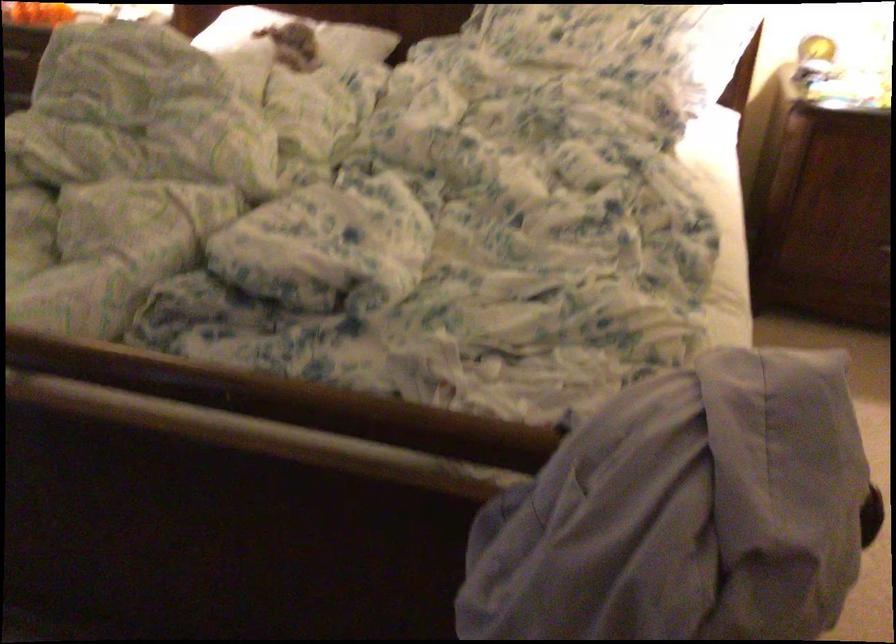
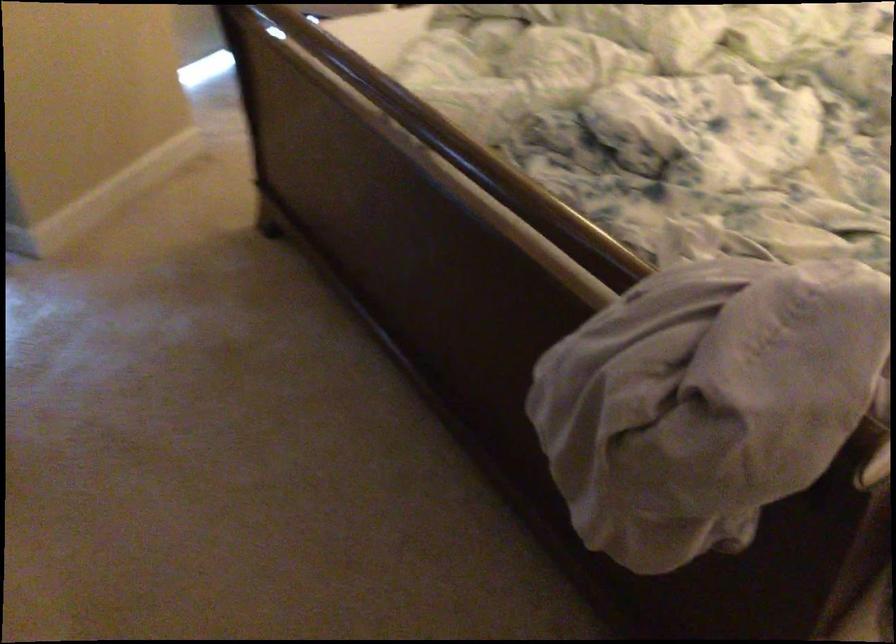
Question: How did the camera likely rotate?

Choices:
 (A) Left
 (B) Right
 (C) Up
 (D) Down

Answer: (A)